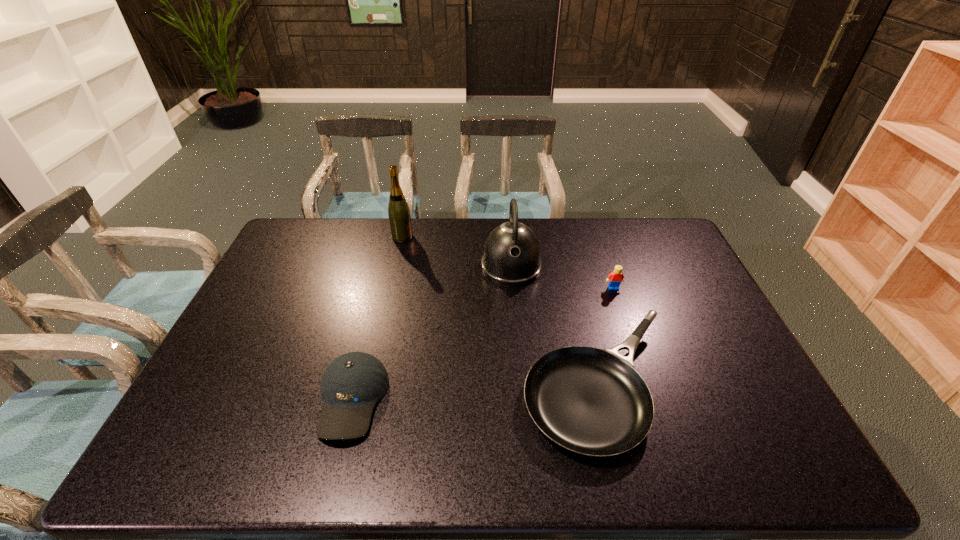
Image resolution: width=960 pixels, height=540 pixels. What are the coordinates of `object that stands as the second closest to the baseball cap` in the screenshot? It's located at (512, 255).

The image size is (960, 540). What are the coordinates of `free space that satisfies the following two spatial constraints: 1. on the front-facing side of the wine bottle; 2. on the back side of the shortest object` in the screenshot? It's located at (369, 386).

You are a GUI agent. You are given a task and a screenshot of the screen. Output one action in this format:
    pyautogui.click(x=<x>, y=<y>)
    Task: Click on the free location that satisfies the following two spatial constraints: 1. on the front-facing side of the farthest object; 2. on the front-facing side of the baseball cap
    
    Given the screenshot: What is the action you would take?
    pyautogui.click(x=366, y=399)

You are a GUI agent. You are given a task and a screenshot of the screen. Output one action in this format:
    pyautogui.click(x=<x>, y=<y>)
    Task: Click on the free space that satisfies the following two spatial constraints: 1. on the front-facing side of the wine bottle; 2. on the front-facing side of the baseball cap
    The height and width of the screenshot is (540, 960).
    Given the screenshot: What is the action you would take?
    pos(366,399)

Find the location of a particular element. The image size is (960, 540). vacant space that satisfies the following two spatial constraints: 1. on the spout of the pan; 2. on the right side of the kettle is located at coordinates (521, 386).

Where is `free space in the image that satisfies the following two spatial constraints: 1. on the front-facing side of the wine bottle; 2. on the back side of the shortest object`? The height and width of the screenshot is (540, 960). free space in the image that satisfies the following two spatial constraints: 1. on the front-facing side of the wine bottle; 2. on the back side of the shortest object is located at coordinates (369, 386).

You are a GUI agent. You are given a task and a screenshot of the screen. Output one action in this format:
    pyautogui.click(x=<x>, y=<y>)
    Task: Click on the blank area in the image that satisfies the following two spatial constraints: 1. on the front-facing side of the farthest object; 2. on the left side of the shortest object
    The height and width of the screenshot is (540, 960).
    Given the screenshot: What is the action you would take?
    pyautogui.click(x=369, y=386)